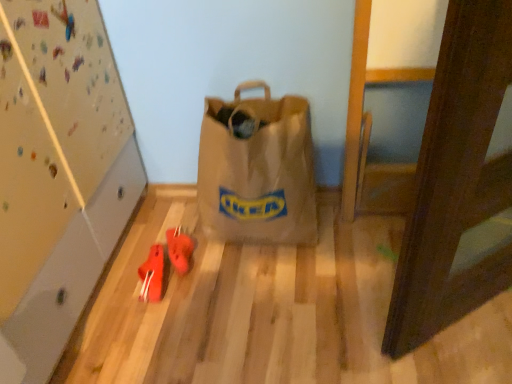
You are a GUI agent. You are given a task and a screenshot of the screen. Output one action in this format:
    pyautogui.click(x=<x>, y=<y>)
    Task: Click on the free region on the left part of rubberized red shoes at lower left, the first footwear when ordered from left to right
    The width and height of the screenshot is (512, 384).
    Given the screenshot: What is the action you would take?
    pyautogui.click(x=115, y=290)